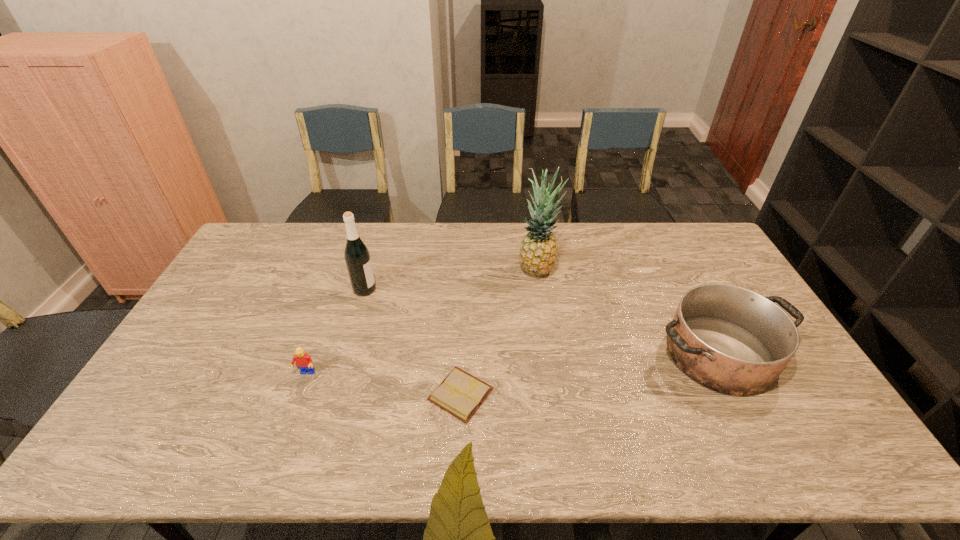
The image size is (960, 540). In order to click on object that stands as the fourth closest to the leftmost object in this screenshot , I will do `click(732, 340)`.

At what (x,y) coordinates should I click in order to perform the action: click on object that is the closest to the third object from left to right. Please return your answer as a coordinate pair (x, y). Looking at the image, I should click on pyautogui.click(x=304, y=362).

Image resolution: width=960 pixels, height=540 pixels. Find the location of `vacant space that satisfies the following two spatial constraints: 1. on the front side of the third shortest object; 2. on the left side of the pineapple`. vacant space that satisfies the following two spatial constraints: 1. on the front side of the third shortest object; 2. on the left side of the pineapple is located at coordinates (551, 354).

Find the location of a particular element. This screenshot has height=540, width=960. vacant area that satisfies the following two spatial constraints: 1. on the label of the fourth object from right to left; 2. on the back side of the third shortest object is located at coordinates (346, 354).

At what (x,y) coordinates should I click in order to perform the action: click on free location that satisfies the following two spatial constraints: 1. on the front side of the tallest object; 2. on the label of the wine bottle. Please return your answer as a coordinate pair (x, y). Looking at the image, I should click on (540, 289).

You are a GUI agent. You are given a task and a screenshot of the screen. Output one action in this format:
    pyautogui.click(x=<x>, y=<y>)
    Task: Click on the vacant space that satisfies the following two spatial constraints: 1. on the back side of the third object from left to right; 2. on the right side of the fourth object from left to right
    The image size is (960, 540).
    Given the screenshot: What is the action you would take?
    pyautogui.click(x=466, y=269)

The width and height of the screenshot is (960, 540). Identify the location of vacant space that satisfies the following two spatial constraints: 1. on the label of the wine bottle; 2. on the back side of the saucepan. (346, 354).

This screenshot has height=540, width=960. Identify the location of free space that satisfies the following two spatial constraints: 1. on the label of the third shortest object; 2. on the right side of the second tallest object. (346, 354).